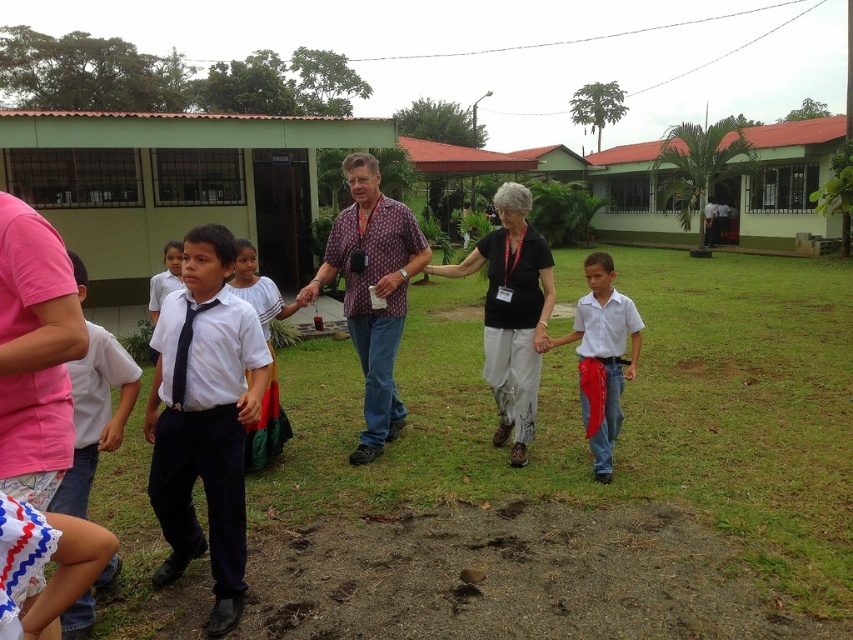
You are standing at the point with coordinates point (596,476) and want to walk towards the point with coordinates point (103,440). Which direction should you face to move closer to your destination?

Since point (103,440) is closer to the viewer than point (596,476), you should face towards the direction of the viewer to move closer to your destination.

You are a photographer standing in front of the group. You notice two white shirts in the scene, one labeled as white cotton shirt at left and the other as white glossy shirt at center. Which shirt is positioned closer to you?

The white cotton shirt at left is closer to the viewer than the white glossy shirt at center.

In the scene shown: Based on the scene description, where is the white cotton shirt at center located in the image?

The white cotton shirt at center is located at point [451,509].